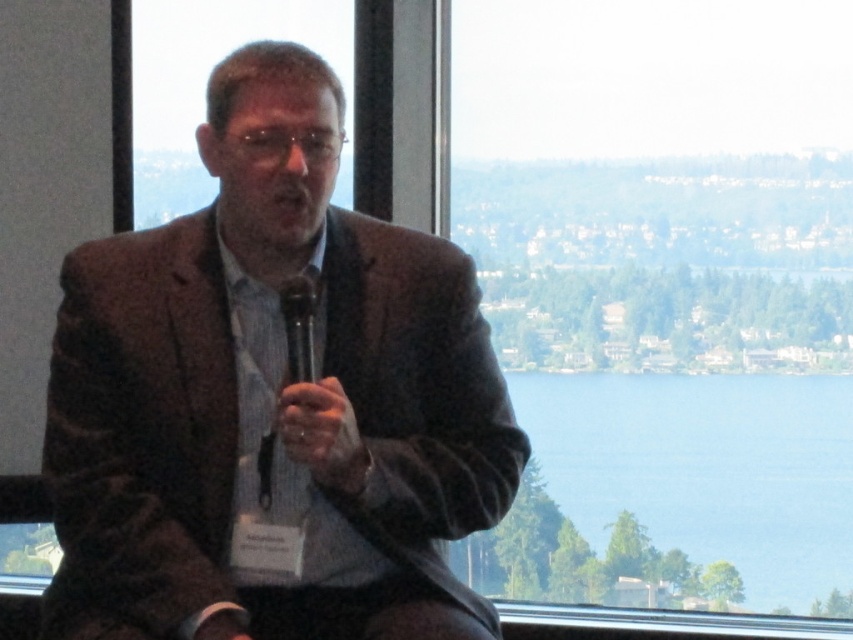
You are a photographer standing in front of the scene. You want to take a photo that includes both the man and the scenic view outside the window. The man is at point (715, 387) and the scenic view is at point (292, 296). Which point should you focus on first to ensure both are in focus?

You should focus on point (292, 296) first because it is closer to the camera than point (715, 387). By focusing on the closer point, the depth of field may extend to include the farther point as well, ensuring both the man and the scenic view are in focus.

You are an interior designer observing the scene. You need to determine if the textured brown blazer at center can be placed on a shelf that is the same height as the blue water at center. Can it fit vertically?

Result: The textured brown blazer at center is not as tall as blue water at center, so it can fit vertically on a shelf of the same height as the blue water at center.